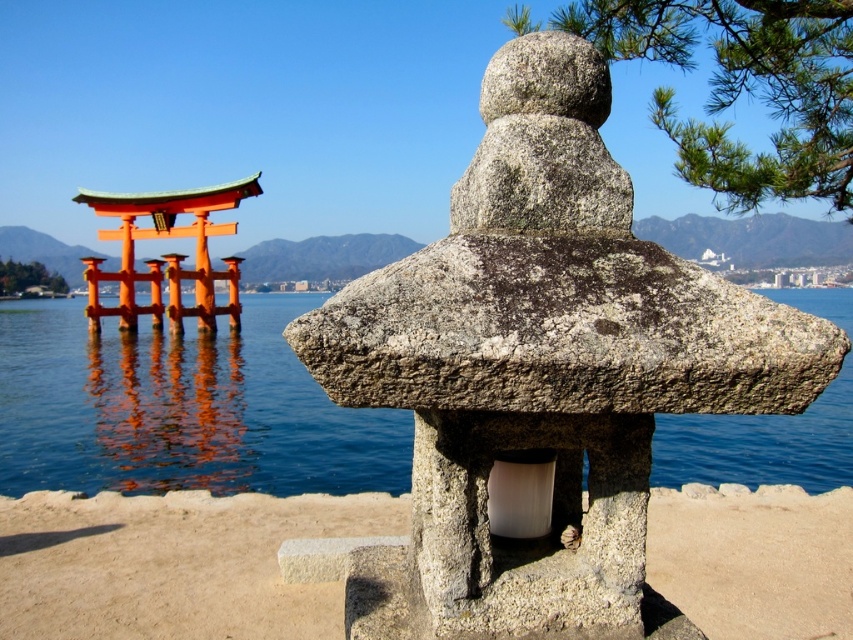
In the scene shown: You are a visitor at a Japanese garden and see the gray stone lantern at center and the smooth concrete base at center. Which object is directly on top of the other?

The gray stone lantern at center is positioned over the smooth concrete base at center, so the gray stone lantern at center is directly on top of the smooth concrete base at center.

You are standing in a Japanese garden and see the blue water at center and the smooth concrete base at center. Which one is higher in elevation?

The blue water at center is located above the smooth concrete base at center, so the blue water at center is higher in elevation.